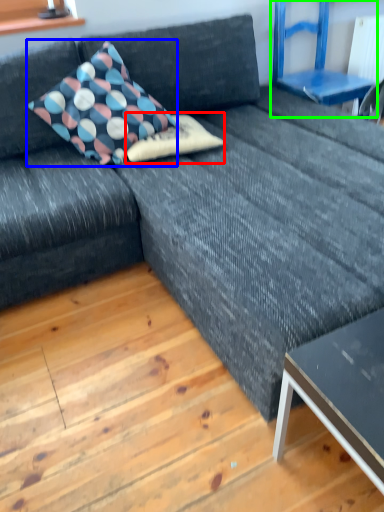
Question: Which is farther away from pillow (highlighted by a red box)? pillow (highlighted by a blue box) or armchair (highlighted by a green box)?

Choices:
 (A) pillow
 (B) armchair

Answer: (B)